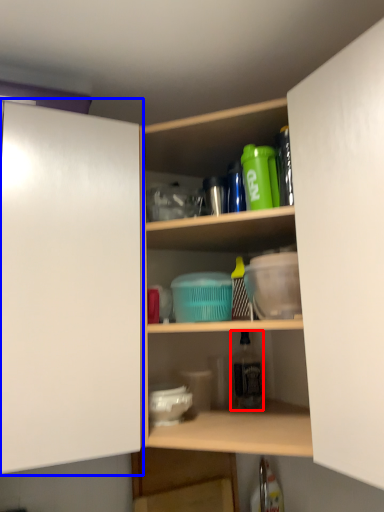
Question: Which point is closer to the camera, bottle (highlighted by a red box) or cabinetry (highlighted by a blue box)?

Choices:
 (A) bottle
 (B) cabinetry

Answer: (B)